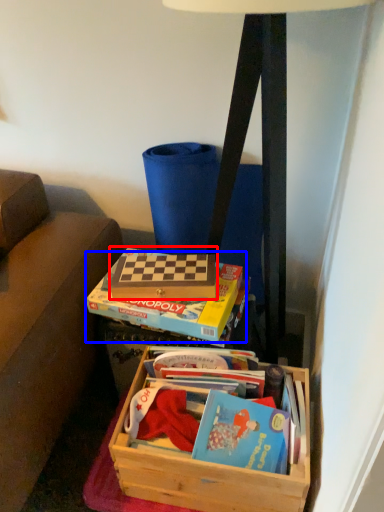
Question: Which point is closer to the camera, paperback book (highlighted by a red box) or paperback book (highlighted by a blue box)?

Choices:
 (A) paperback book
 (B) paperback book

Answer: (B)